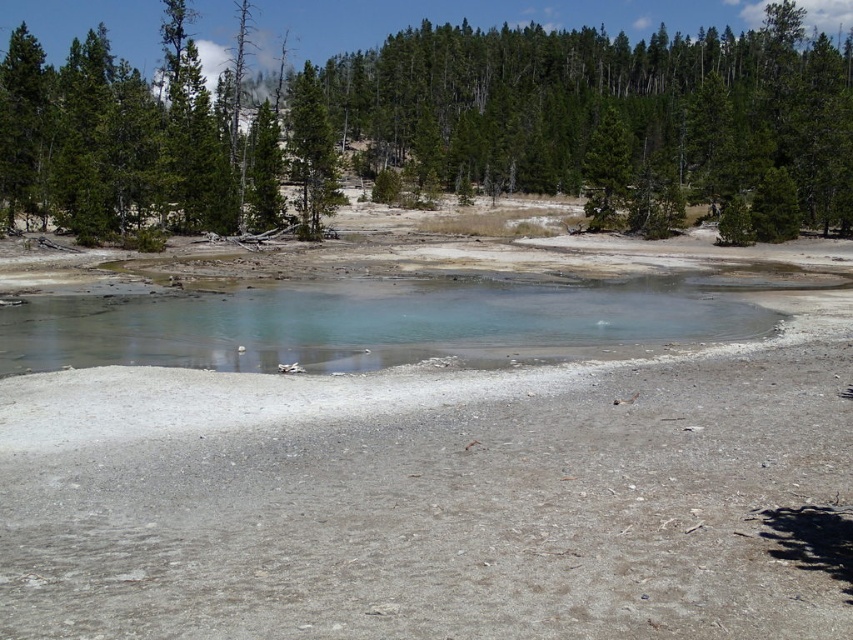
Can you confirm if clear glass water at center is positioned to the left of green textured pine tree at upper center?

Incorrect, clear glass water at center is not on the left side of green textured pine tree at upper center.

Who is more distant from viewer, (x=38, y=320) or (x=305, y=124)?

The point (x=305, y=124) is more distant.

Is point (503, 326) closer to viewer compared to point (300, 116)?

Yes, point (503, 326) is in front of point (300, 116).

Find the location of a particular element. Image resolution: width=853 pixels, height=640 pixels. clear glass water at center is located at coordinates (369, 324).

Does green leafy tree at upper center have a smaller size compared to green textured pine tree at upper center?

Incorrect, green leafy tree at upper center is not smaller in size than green textured pine tree at upper center.

Can you confirm if green leafy tree at upper center is wider than green textured pine tree at upper center?

Correct, the width of green leafy tree at upper center exceeds that of green textured pine tree at upper center.

Who is more forward, (201, 132) or (322, 140)?

Point (322, 140) is more forward.

You are a GUI agent. You are given a task and a screenshot of the screen. Output one action in this format:
    pyautogui.click(x=<x>, y=<y>)
    Task: Click on the green leafy tree at upper center
    
    Given the screenshot: What is the action you would take?
    pyautogui.click(x=439, y=125)

Which is above, green leafy tree at upper center or clear glass water at center?

green leafy tree at upper center is higher up.

Can you confirm if green leafy tree at upper center is bigger than clear glass water at center?

Indeed, green leafy tree at upper center has a larger size compared to clear glass water at center.

Between point (378, 92) and point (380, 346), which one is positioned behind?

The point (378, 92) is behind.

Locate an element on the screen. The height and width of the screenshot is (640, 853). green leafy tree at upper center is located at coordinates [x=439, y=125].